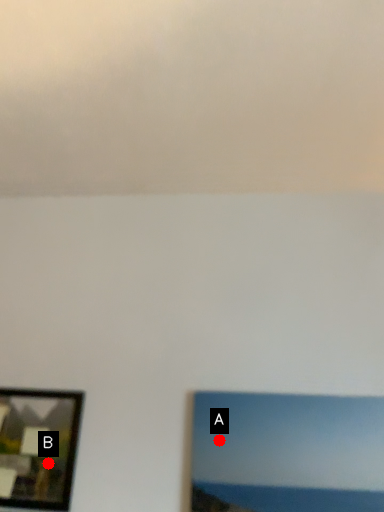
Question: Two points are circled on the image, labeled by A and B beside each circle. Which point is closer to the camera taking this photo?

Choices:
 (A) A is closer
 (B) B is closer

Answer: (A)